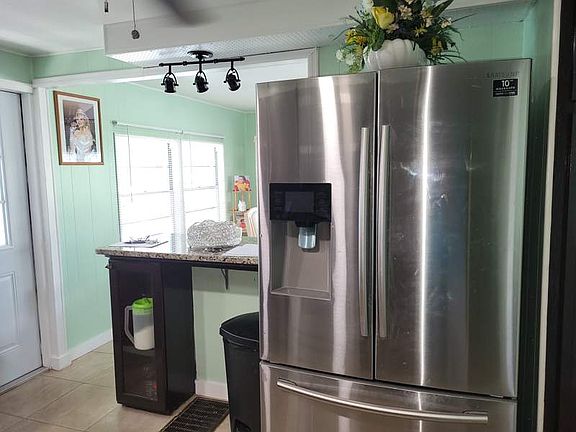
You are a GUI agent. You are given a task and a screenshot of the screen. Output one action in this format:
    pyautogui.click(x=<x>, y=<y>)
    Task: Click on the ice dispenser
    
    Given the screenshot: What is the action you would take?
    pyautogui.click(x=305, y=238)